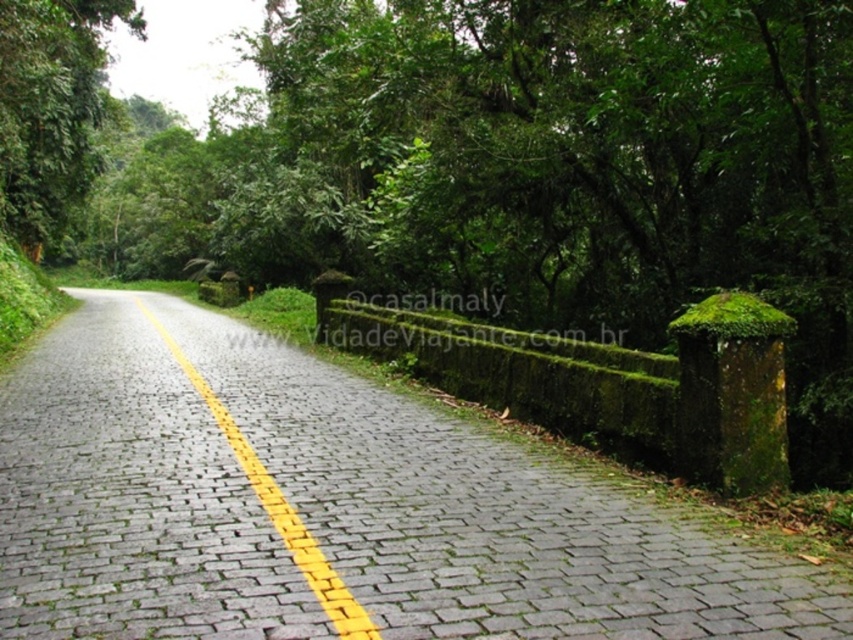
Question: Which of the following is the closest to the observer?

Choices:
 (A) mossy stone hedge at right
 (B) green leafy tree at left
 (C) gray cobblestone road at center

Answer: (C)

Question: Where is mossy stone hedge at right located in relation to green leafy tree at left in the image?

Choices:
 (A) left
 (B) right

Answer: (B)

Question: Which of these objects is positioned closest to the green leafy tree at left?

Choices:
 (A) gray cobblestone road at center
 (B) yellowsmoothline at center
 (C) mossy stone hedge at right

Answer: (B)

Question: Which object is the closest to the mossy stone hedge at right?

Choices:
 (A) yellowsmoothline at center
 (B) gray cobblestone road at center

Answer: (B)

Question: Considering the relative positions of green leafy tree at left and yellowsmoothline at center in the image provided, where is green leafy tree at left located with respect to yellowsmoothline at center?

Choices:
 (A) right
 (B) left

Answer: (B)

Question: Is gray cobblestone road at center below mossy stone hedge at right?

Choices:
 (A) yes
 (B) no

Answer: (A)